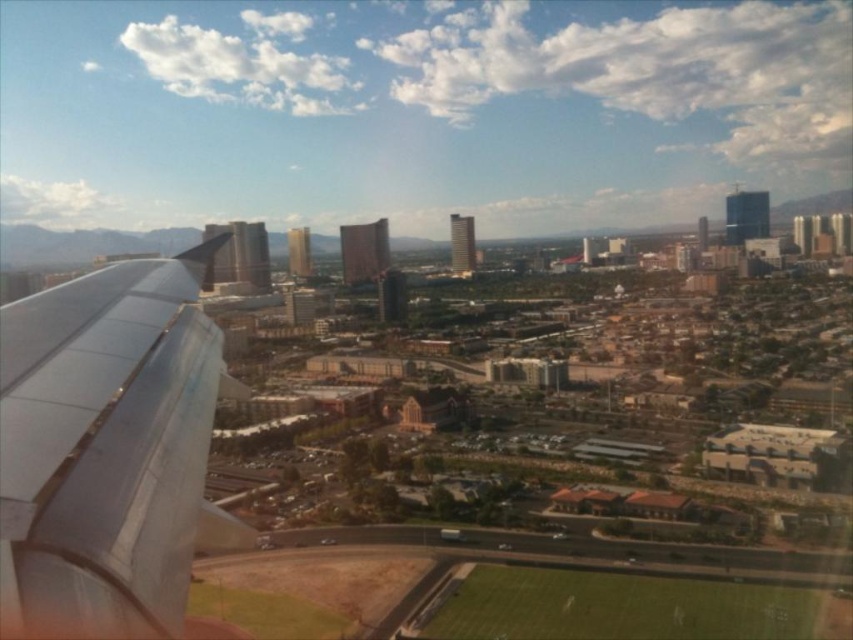
Question: Observing the image, what is the correct spatial positioning of metallic gray wing at left in reference to green grass football field at lower center?

Choices:
 (A) right
 (B) left

Answer: (B)

Question: Among these objects, which one is farthest from the camera?

Choices:
 (A) metallic gray wing at left
 (B) green grass football field at lower center

Answer: (B)

Question: Can you confirm if metallic gray wing at left is positioned to the left of green grass football field at lower center?

Choices:
 (A) no
 (B) yes

Answer: (B)

Question: Does metallic gray wing at left appear on the left side of green grass football field at lower center?

Choices:
 (A) no
 (B) yes

Answer: (B)